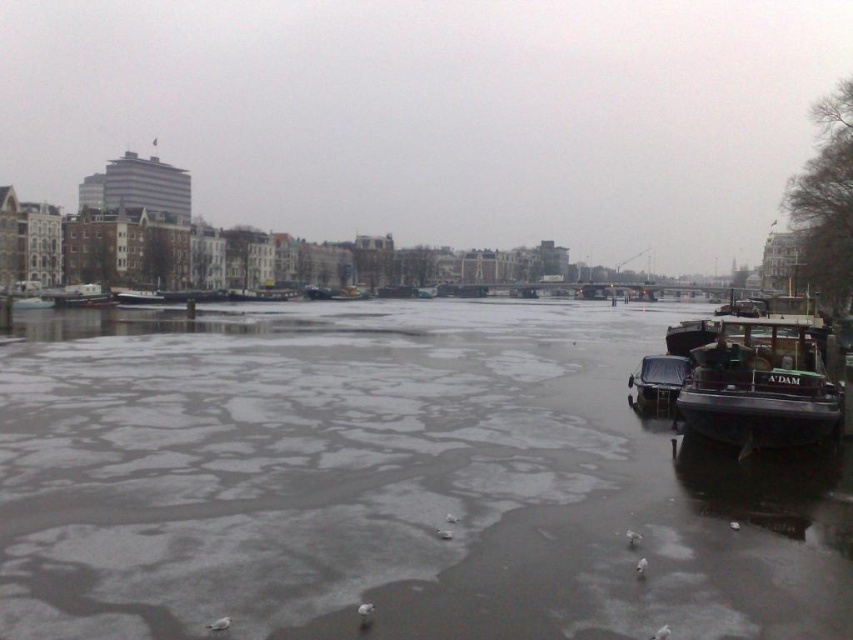
Consider the image. You are standing on the canal bank and want to board the dark gray wooden boat at right and the dark blue matte boat at right. Which boat is closer to you?

The dark gray wooden boat at right is closer to you because it is in front of the dark blue matte boat at right.

You are standing at the point with coordinates [763,378] in the winter canal scene. What object are you directly positioned at?

You are directly positioned at the dark gray wooden boat at right.

You are standing at the center of the canal and want to reach the dark gray wooden boat at right. Which direction should you head towards?

You should head towards the right direction to reach the dark gray wooden boat at right since it is located at the right side of the canal.